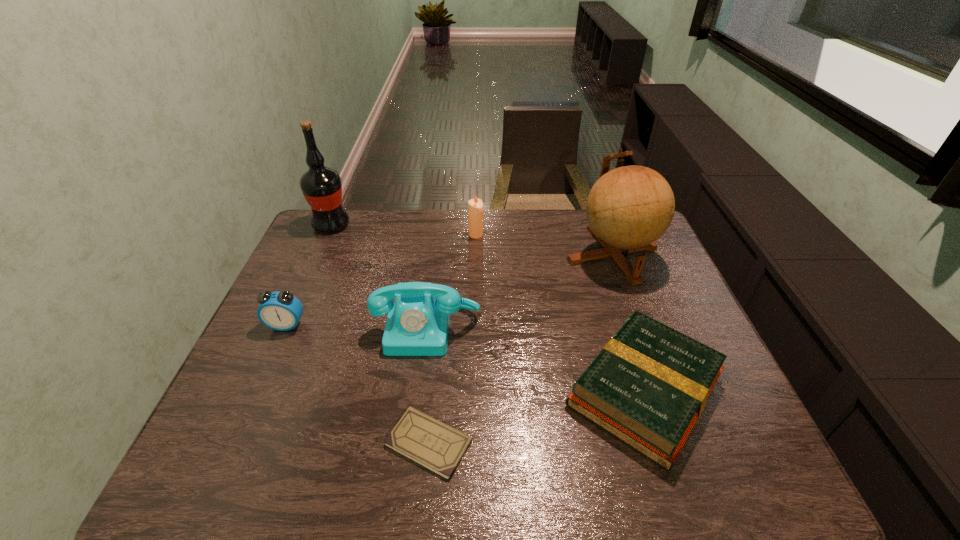
Locate an element on the screen. vacant space located on the front of the candle is located at coordinates (475, 252).

I want to click on free spot located on the face of the third shortest object, so click(236, 436).

Identify the location of free space located 0.200m on the left of the second shortest object. [477, 390].

Find the location of a particular element. The height and width of the screenshot is (540, 960). free space located on the back of the checkbook is located at coordinates click(x=442, y=302).

I want to click on wine bottle that is at the far edge, so click(x=321, y=186).

You are a GUI agent. You are given a task and a screenshot of the screen. Output one action in this format:
    pyautogui.click(x=<x>, y=<y>)
    Task: Click on the globe present at the far edge
    The width and height of the screenshot is (960, 540).
    Given the screenshot: What is the action you would take?
    click(628, 208)

Where is `candle that is at the far edge`? The width and height of the screenshot is (960, 540). candle that is at the far edge is located at coordinates [475, 206].

Where is `hardback book positioned at the near edge`? Image resolution: width=960 pixels, height=540 pixels. hardback book positioned at the near edge is located at coordinates [x=648, y=386].

In order to click on checkbook situated at the near edge in this screenshot , I will do `click(436, 446)`.

Where is `wine bottle present at the left edge`? The height and width of the screenshot is (540, 960). wine bottle present at the left edge is located at coordinates (321, 186).